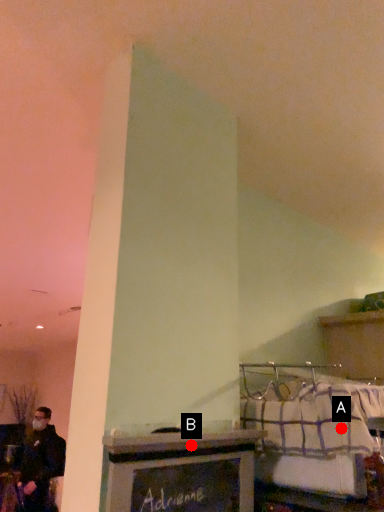
Question: Two points are circled on the image, labeled by A and B beside each circle. Which point is closer to the camera?

Choices:
 (A) A is closer
 (B) B is closer

Answer: (B)